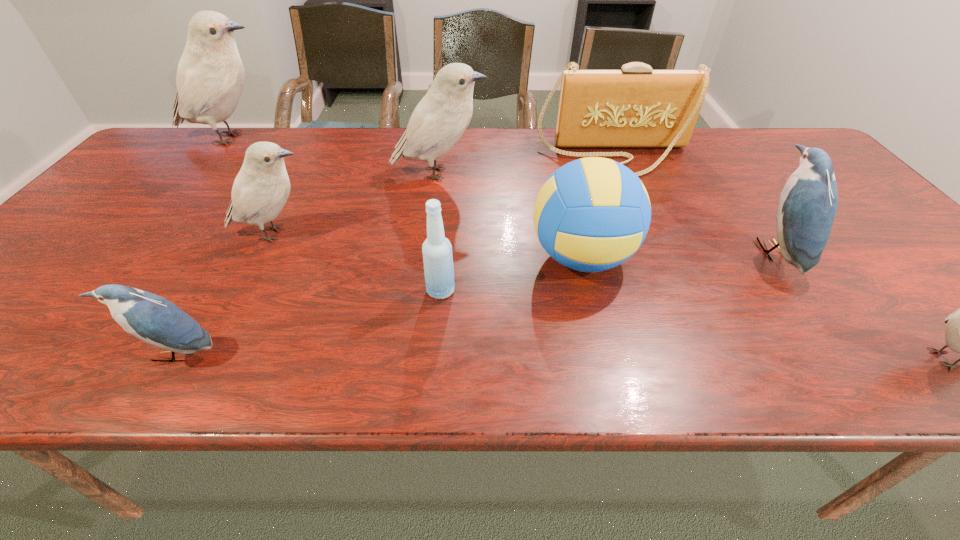
Identify the location of vacant area at the far right corner. (796, 164).

The image size is (960, 540). I want to click on vacant space in between the second object from right to left and the bottle, so click(607, 271).

Image resolution: width=960 pixels, height=540 pixels. I want to click on free space between the bottle and the third biggest white bird, so click(358, 262).

Find the location of `empty location between the blue volleyball and the second tallest object`. empty location between the blue volleyball and the second tallest object is located at coordinates (510, 215).

The image size is (960, 540). Identify the location of vacant space that is in between the bottle and the bigger blue bird. (607, 271).

Identify the location of vacant space that's between the left blue bird and the tallest object. Image resolution: width=960 pixels, height=540 pixels. (203, 246).

The image size is (960, 540). In order to click on empty location between the volleyball and the second bird from right to left in this screenshot , I will do `click(678, 254)`.

Find the location of `empty location between the handbag and the left blue bird`. empty location between the handbag and the left blue bird is located at coordinates (395, 255).

This screenshot has height=540, width=960. Identify the location of vacant area that lies between the bottle and the third farthest white bird. (358, 262).

Identify the location of vacant region between the nearer blue bird and the bottle. This screenshot has height=540, width=960. (307, 322).